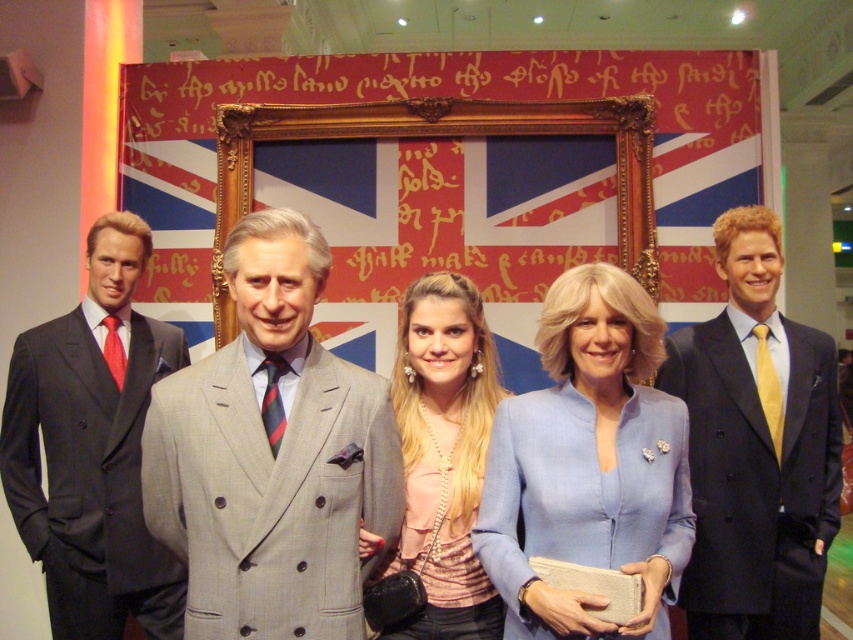
Question: Which point is farther to the camera?

Choices:
 (A) (79, 394)
 (B) (728, 280)
 (C) (668, 465)
 (D) (654, 278)

Answer: (D)

Question: Considering the relative positions of pearl necklace at center and goldwooden frame at center in the image provided, where is pearl necklace at center located with respect to goldwooden frame at center?

Choices:
 (A) below
 (B) above

Answer: (A)

Question: Which object is positioned farthest from the dark blue suit at right?

Choices:
 (A) gray wool suit at center
 (B) light blue fabric jacket at center
 (C) matte black suit at left

Answer: (C)

Question: Which object is closer to the camera taking this photo?

Choices:
 (A) goldwooden frame at center
 (B) light blue fabric jacket at center
 (C) pearl necklace at center

Answer: (B)

Question: Does gray wool suit at center appear over pearl necklace at center?

Choices:
 (A) no
 (B) yes

Answer: (B)

Question: Is light blue fabric jacket at center above goldwooden frame at center?

Choices:
 (A) no
 (B) yes

Answer: (A)